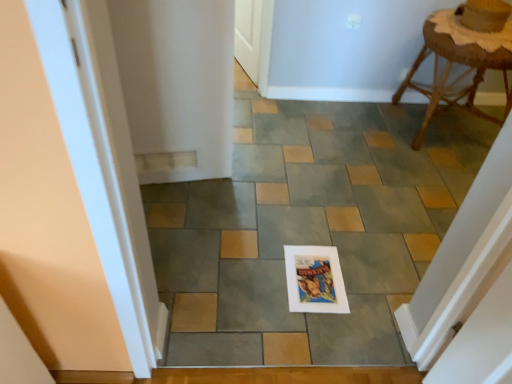
The width and height of the screenshot is (512, 384). What are the coordinates of `free space that is to the left of rattan stool at upper right` in the screenshot? It's located at (361, 130).